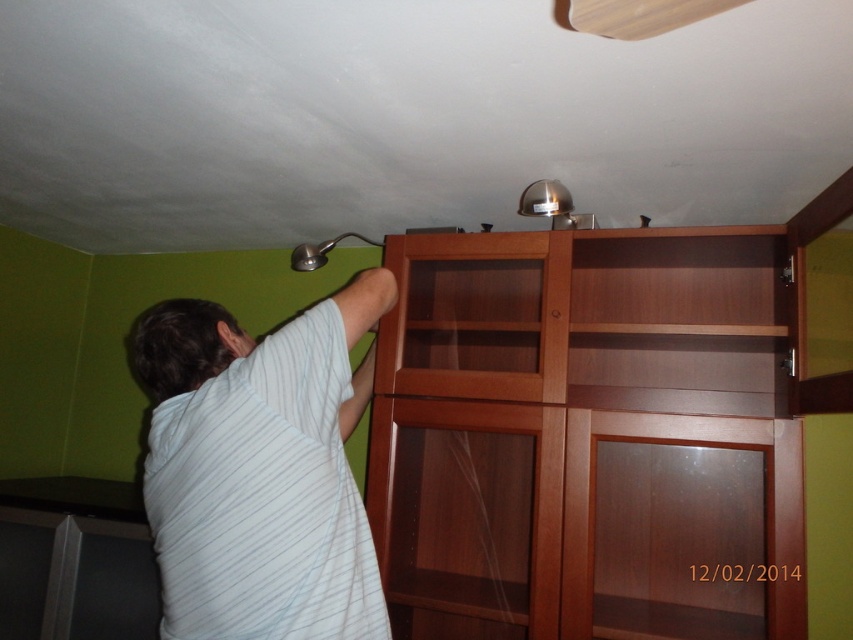
Question: Observing the image, what is the correct spatial positioning of wooden cabinet at right in reference to white striped shirt at upper left?

Choices:
 (A) left
 (B) right

Answer: (B)

Question: Can you confirm if wooden cabinet at right is positioned above white striped shirt at upper left?

Choices:
 (A) yes
 (B) no

Answer: (B)

Question: Does wooden cabinet at right appear over white striped shirt at upper left?

Choices:
 (A) no
 (B) yes

Answer: (A)

Question: Which point appears closest to the camera in this image?

Choices:
 (A) (546, 556)
 (B) (241, 420)

Answer: (B)